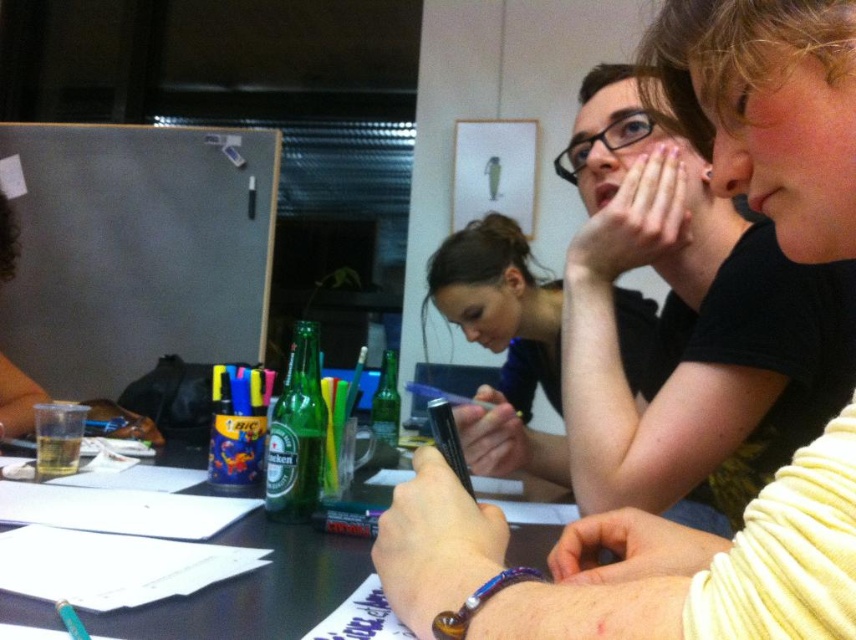
Question: Does smooth black shirt at center come in front of translucent plastic table at center?

Choices:
 (A) no
 (B) yes

Answer: (A)

Question: Does matte black pen at center appear on the left side of smooth black shirt at center?

Choices:
 (A) no
 (B) yes

Answer: (B)

Question: Does smooth black shirt at center appear under translucent plastic table at center?

Choices:
 (A) no
 (B) yes

Answer: (A)

Question: Estimate the real-world distances between objects in this image. Which object is closer to the matte black pen at center?

Choices:
 (A) translucent plastic table at center
 (B) smooth black shirt at center

Answer: (A)

Question: Among these points, which one is nearest to the camera?

Choices:
 (A) (440, 310)
 (B) (340, 540)
 (C) (693, 317)
 (D) (792, 154)

Answer: (D)

Question: Which of the following is the closest to the observer?

Choices:
 (A) translucent plastic table at center
 (B) matte black pen at center
 (C) smooth black shirt at upper right

Answer: (B)